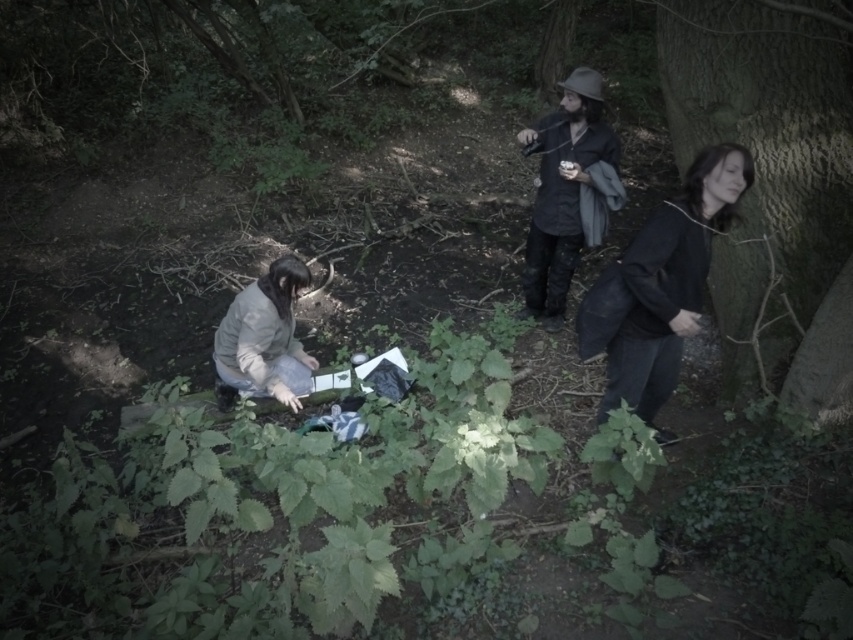
You are navigating through the wooded area and need to reach a specific location. You have two reference points marked as point (579, 228) and point (280, 397). Which point should you head towards first if you want to reach the destination that is behind both points?

You should head towards point (280, 397) first because point (579, 228) is behind it, so reaching the closer point first allows you to proceed towards the destination more efficiently.

Looking at this image, you are a photographer setting up a shot in this wooded area. You want to ensure both the dark gray fabric jacket at right and the black matte shirt at center are clearly visible in your frame. Considering their positions and sizes, which object should you focus on first to ensure depth of field captures both effectively?

The dark gray fabric jacket at right might be wider than the black matte shirt at center, so focusing on the closer object first would help maintain depth of field for both. However, since the jacket is wider, ensuring it is within the focal range is crucial.

You are a hiker who has just arrived at this wooded area and need to move from the dark gray fabric jacket at right to the light gray fabric at lower left. Given that your backpack is 2 feet wide, will you be able to move through the space between them without needing to adjust your path?

The distance between the dark gray fabric jacket at right and the light gray fabric at lower left is 6.36 feet. Since your backpack is 2 feet wide, there is sufficient space to move through without needing to adjust your path.